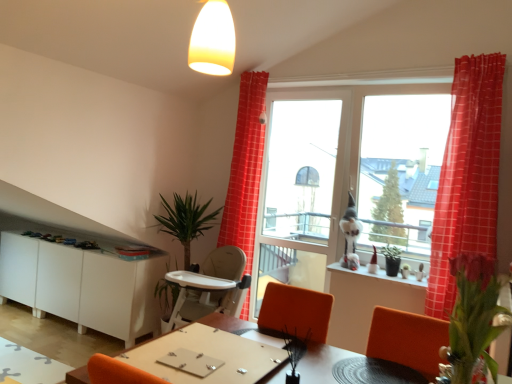
Question: From the image's perspective, is white matte cabinet at lower left under green leafy plant at left?

Choices:
 (A) yes
 (B) no

Answer: (A)

Question: Is white matte cabinet at lower left far away from green leafy plant at left?

Choices:
 (A) no
 (B) yes

Answer: (A)

Question: Can we say white matte cabinet at lower left lies outside green leafy plant at left?

Choices:
 (A) yes
 (B) no

Answer: (A)

Question: Does white matte cabinet at lower left turn towards green leafy plant at left?

Choices:
 (A) no
 (B) yes

Answer: (A)

Question: From a real-world perspective, does white matte cabinet at lower left sit lower than green leafy plant at left?

Choices:
 (A) yes
 (B) no

Answer: (A)

Question: Considering the positions of point [x=118, y=258] and point [x=459, y=362], is point [x=118, y=258] closer or farther from the camera than point [x=459, y=362]?

Choices:
 (A) closer
 (B) farther

Answer: (B)

Question: From a real-world perspective, is white matte cabinet at lower left above or below pink matte flower at right, which appears as the first plant when viewed from the right?

Choices:
 (A) above
 (B) below

Answer: (B)

Question: Is white matte cabinet at lower left bigger or smaller than pink matte flower at right, which appears as the first plant when viewed from the right?

Choices:
 (A) small
 (B) big

Answer: (B)

Question: Relative to pink matte flower at right, placed as the second plant when sorted from left to right, is white matte cabinet at lower left in front or behind?

Choices:
 (A) front
 (B) behind

Answer: (B)

Question: Is transparent glass window at upper right taller or shorter than pink matte flower at right, positioned as the 2th plant in back-to-front order?

Choices:
 (A) short
 (B) tall

Answer: (B)

Question: Would you say transparent glass window at upper right is to the left or to the right of pink matte flower at right, which is counted as the 1th plant, starting from the front, in the picture?

Choices:
 (A) left
 (B) right

Answer: (B)

Question: In the image, is transparent glass window at upper right positioned in front of or behind pink matte flower at right, placed as the second plant when sorted from left to right?

Choices:
 (A) front
 (B) behind

Answer: (B)

Question: Considering the positions of transparent glass window at upper right and pink matte flower at right, which appears as the first plant when viewed from the right, in the image, is transparent glass window at upper right bigger or smaller than pink matte flower at right, which appears as the first plant when viewed from the right,?

Choices:
 (A) big
 (B) small

Answer: (A)

Question: In the image, is white glossy window sill at lower right positioned in front of or behind green matte plant at lower center, which is counted as the first plant, starting from the left?

Choices:
 (A) front
 (B) behind

Answer: (B)

Question: Considering the positions of white glossy window sill at lower right and green matte plant at lower center, marked as the second plant in a right-to-left arrangement, in the image, is white glossy window sill at lower right wider or thinner than green matte plant at lower center, marked as the second plant in a right-to-left arrangement,?

Choices:
 (A) thin
 (B) wide

Answer: (B)